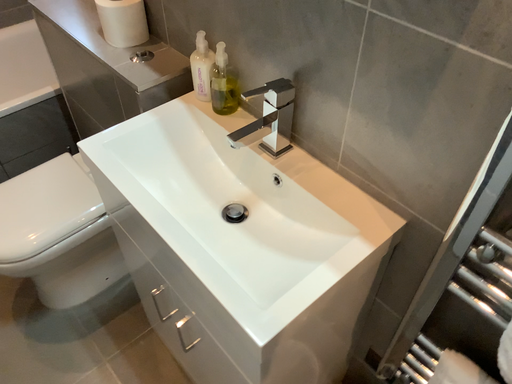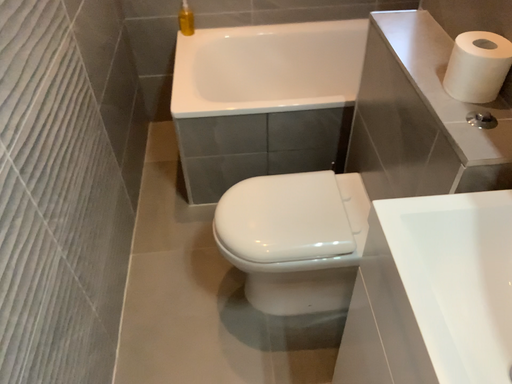
Question: Which way did the camera rotate in the video?

Choices:
 (A) rotated left
 (B) rotated right

Answer: (A)